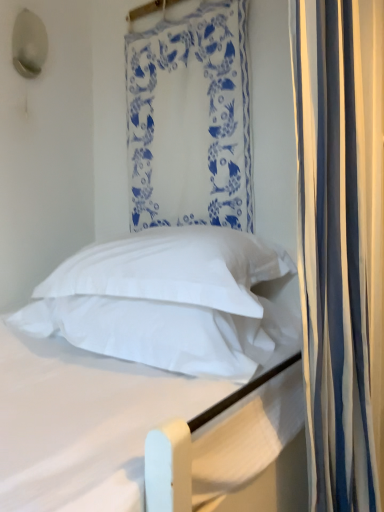
Question: Is white striped curtain at right, which is counted as the 2th curtain, starting from the back, to the left of white soft pillow at center, which is counted as the second pillow, starting from the bottom, from the viewer's perspective?

Choices:
 (A) yes
 (B) no

Answer: (B)

Question: Considering the relative sizes of white striped curtain at right, placed as the first curtain when sorted from front to back, and white soft pillow at center, which is counted as the second pillow, starting from the bottom, in the image provided, is white striped curtain at right, placed as the first curtain when sorted from front to back, wider than white soft pillow at center, which is counted as the second pillow, starting from the bottom,?

Choices:
 (A) yes
 (B) no

Answer: (B)

Question: From the image's perspective, is white striped curtain at right, which is the first curtain in right-to-left order, below white soft pillow at center, which is counted as the second pillow, starting from the bottom?

Choices:
 (A) no
 (B) yes

Answer: (A)

Question: Is white soft pillow at center, the 1th pillow in the top-to-bottom sequence, surrounded by white striped curtain at right, marked as the second curtain in a left-to-right arrangement?

Choices:
 (A) yes
 (B) no

Answer: (B)

Question: Is white striped curtain at right, marked as the second curtain in a left-to-right arrangement, further to the viewer compared to white soft pillow at center, the 1th pillow in the top-to-bottom sequence?

Choices:
 (A) yes
 (B) no

Answer: (B)

Question: Is point click(99, 375) closer or farther from the camera than point click(228, 365)?

Choices:
 (A) farther
 (B) closer

Answer: (A)

Question: Is white soft bed at center inside the boundaries of white soft pillow at center, which is the second pillow in top-to-bottom order, or outside?

Choices:
 (A) outside
 (B) inside

Answer: (A)

Question: Is white soft bed at center taller or shorter than white soft pillow at center, which is the second pillow in top-to-bottom order?

Choices:
 (A) tall
 (B) short

Answer: (A)

Question: From the image's perspective, relative to white soft pillow at center, which appears as the 1th pillow when ordered from the bottom, is white soft bed at center above or below?

Choices:
 (A) below
 (B) above

Answer: (A)

Question: From a real-world perspective, is white soft pillow at center, which is counted as the second pillow, starting from the bottom, above or below white soft bed at center?

Choices:
 (A) below
 (B) above

Answer: (B)

Question: Considering the positions of point click(180, 229) and point click(193, 322), is point click(180, 229) closer or farther from the camera than point click(193, 322)?

Choices:
 (A) closer
 (B) farther

Answer: (B)

Question: From the image's perspective, relative to white soft bed at center, is white soft pillow at center, which is counted as the second pillow, starting from the bottom, above or below?

Choices:
 (A) below
 (B) above

Answer: (B)

Question: In terms of height, does white soft pillow at center, the 1th pillow in the top-to-bottom sequence, look taller or shorter compared to white soft bed at center?

Choices:
 (A) tall
 (B) short

Answer: (B)

Question: Considering the positions of white striped curtain at right, which is counted as the 2th curtain, starting from the back, and white soft pillow at center, which is the second pillow in top-to-bottom order, in the image, is white striped curtain at right, which is counted as the 2th curtain, starting from the back, bigger or smaller than white soft pillow at center, which is the second pillow in top-to-bottom order,?

Choices:
 (A) small
 (B) big

Answer: (B)

Question: Is white striped curtain at right, placed as the first curtain when sorted from front to back, inside or outside of white soft pillow at center, which is the second pillow in top-to-bottom order?

Choices:
 (A) inside
 (B) outside

Answer: (B)